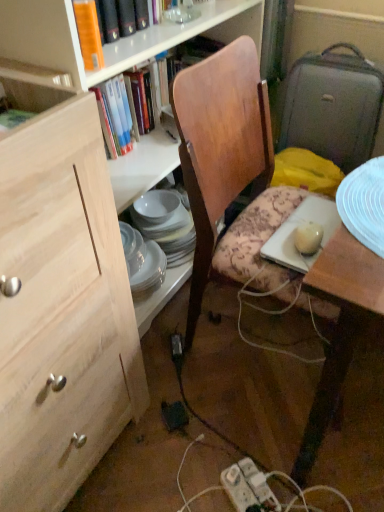
Question: Is gray fabric suitcase at right in front of or behind green matte book at upper left, which is the 3th book from top to bottom, in the image?

Choices:
 (A) front
 (B) behind

Answer: (B)

Question: From a real-world perspective, is gray fabric suitcase at right above or below green matte book at upper left, which is counted as the first book, starting from the front?

Choices:
 (A) below
 (B) above

Answer: (A)

Question: Which object is positioned closest to the green matte book at upper left, which is the first book in bottom-to-top order?

Choices:
 (A) natural wood cabinet at left
 (B) black plastic power plugs and sockets at lower center
 (C) gray fabric suitcase at right
 (D) porcelain plates at center
 (E) wooden chair at center

Answer: (A)

Question: Based on their relative distances, which object is nearer to the green matte book at upper left, which is the 3th book from top to bottom?

Choices:
 (A) natural wood cabinet at left
 (B) black plastic power plugs and sockets at lower center
 (C) orange hardcover book at upper left, the 3th book when ordered from front to back
 (D) wooden desk at right
 (E) wooden chair at center

Answer: (C)